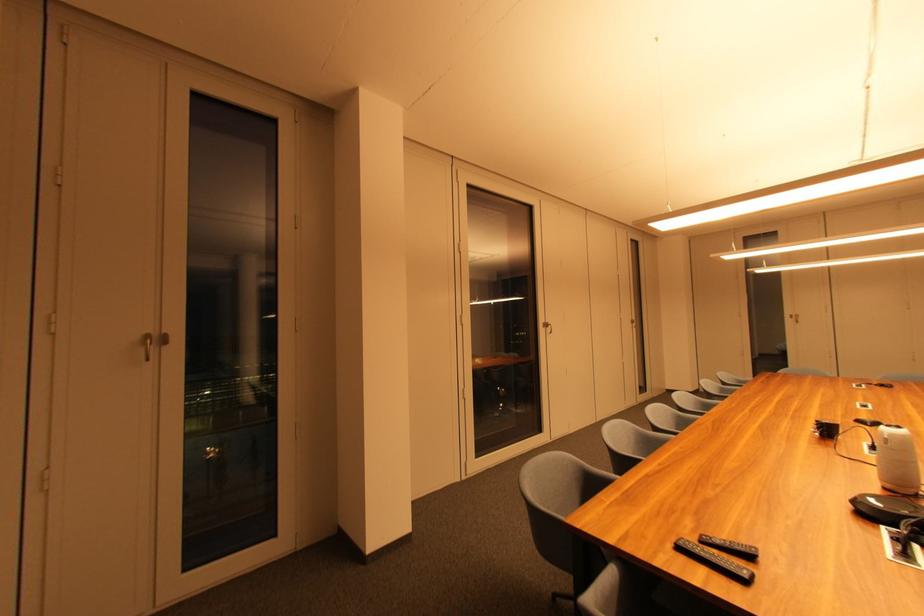
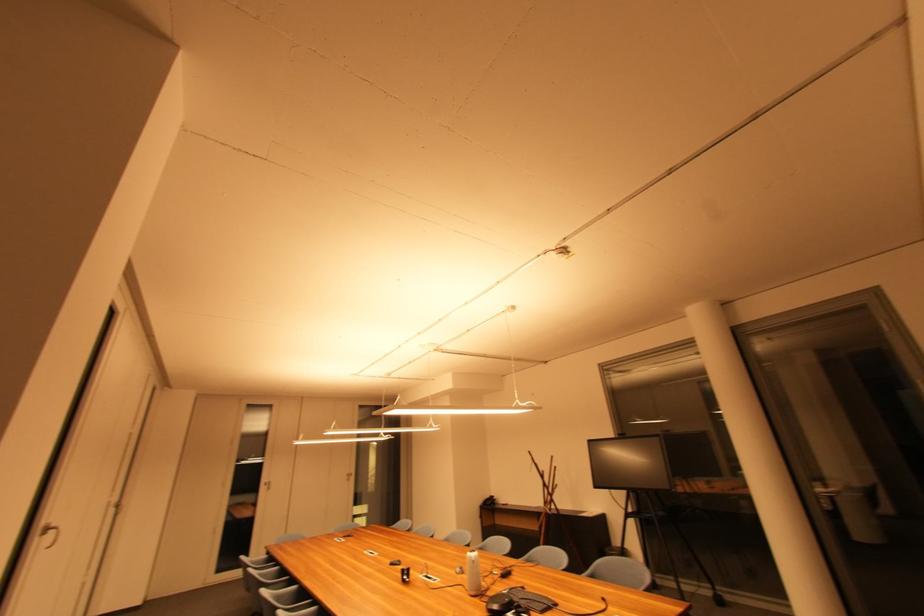
Where in the second image is the point corresponding to point 889,435 from the first image?

(477, 560)